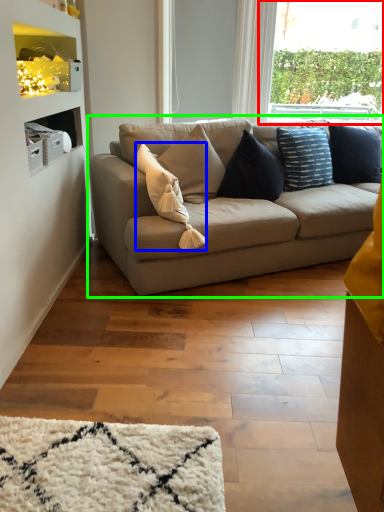
Question: Which object is positioned closest to window (highlighted by a red box)? Select from pillow (highlighted by a blue box) and studio couch (highlighted by a green box).

Choices:
 (A) pillow
 (B) studio couch

Answer: (B)